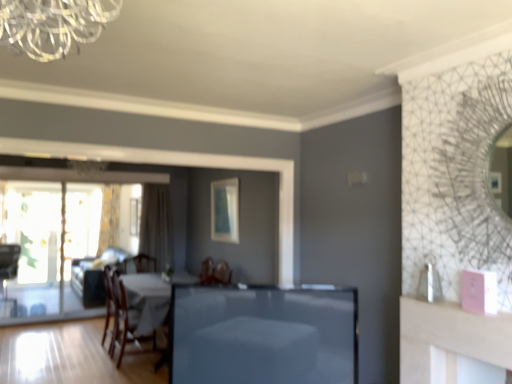
Where is `matte blue picture frame at center, the second picture frame positioned from the back`? This screenshot has height=384, width=512. matte blue picture frame at center, the second picture frame positioned from the back is located at coordinates (225, 210).

The image size is (512, 384). Find the location of `matte white picture frame at center, which is counted as the second picture frame, starting from the front`. matte white picture frame at center, which is counted as the second picture frame, starting from the front is located at coordinates (135, 216).

What do you see at coordinates (156, 225) in the screenshot?
I see `beige fabric curtain at left, which is the 2th curtain from back to front` at bounding box center [156, 225].

Find the location of a particular element. This screenshot has width=512, height=384. velvet beige couch at center is located at coordinates (95, 275).

Locate an element on the screen. Image resolution: width=512 pixels, height=384 pixels. matte blue picture frame at center, the second picture frame positioned from the back is located at coordinates (225, 210).

Which chair is the 2nd one when counting from the front of the matte white picture frame at center, which is counted as the second picture frame, starting from the front? Please provide its 2D coordinates.

[(120, 317)]

Between wooden chair at lower left, marked as the 2th chair in a left-to-right arrangement, and matte white picture frame at center, which is counted as the second picture frame, starting from the front, which one has larger size?

With larger size is wooden chair at lower left, marked as the 2th chair in a left-to-right arrangement.

Considering their positions, is wooden chair at lower left, marked as the 2th chair in a left-to-right arrangement, located in front of or behind matte white picture frame at center, which is counted as the second picture frame, starting from the front?

In the image, wooden chair at lower left, marked as the 2th chair in a left-to-right arrangement, appears in front of matte white picture frame at center, which is counted as the second picture frame, starting from the front.

From a real-world perspective, is wooden chair at lower left, positioned as the 2th chair in back-to-front order, beneath matte white picture frame at center, the second picture frame positioned from the right?

Yes, from a real-world perspective, wooden chair at lower left, positioned as the 2th chair in back-to-front order, is beneath matte white picture frame at center, the second picture frame positioned from the right.

Is wooden chair at lower left, positioned as the 1th chair in front-to-back order, at the left side of matte blue picture frame at center, the first picture frame in the front-to-back sequence?

Correct, you'll find wooden chair at lower left, positioned as the 1th chair in front-to-back order, to the left of matte blue picture frame at center, the first picture frame in the front-to-back sequence.

Consider the image. Is the depth of wooden chair at lower left, positioned as the 2th chair in back-to-front order, greater than that of matte blue picture frame at center, placed as the 2th picture frame when sorted from left to right?

No, it is in front of matte blue picture frame at center, placed as the 2th picture frame when sorted from left to right.

From their relative heights in the image, would you say wooden chair at lower left, positioned as the 2th chair in back-to-front order, is taller or shorter than matte blue picture frame at center, the first picture frame in the front-to-back sequence?

Considering their sizes, wooden chair at lower left, positioned as the 2th chair in back-to-front order, has more height than matte blue picture frame at center, the first picture frame in the front-to-back sequence.

Identify the location of the 1st picture frame positioned above the wooden chair at lower left, positioned as the 1th chair in front-to-back order (from a real-world perspective). Image resolution: width=512 pixels, height=384 pixels. (135, 216).

In the scene shown: Is matte white picture frame at center, the second picture frame positioned from the right, oriented away from wooden chair at lower left, positioned as the 1th chair in front-to-back order?

No, matte white picture frame at center, the second picture frame positioned from the right, is not facing the opposite direction of wooden chair at lower left, positioned as the 1th chair in front-to-back order.

Between matte white picture frame at center, which is counted as the second picture frame, starting from the front, and wooden chair at lower left, positioned as the 1th chair in front-to-back order, which one has more height?

With more height is wooden chair at lower left, positioned as the 1th chair in front-to-back order.

Is matte white picture frame at center, the second picture frame positioned from the right, placed right next to wooden chair at lower left, positioned as the 2th chair in back-to-front order?

No.

Is beige fabric curtain at left, placed as the first curtain when sorted from right to left, aimed at wooden chair at left, arranged as the second chair when viewed from the right?

No, beige fabric curtain at left, placed as the first curtain when sorted from right to left, does not turn towards wooden chair at left, arranged as the second chair when viewed from the right.

From a real-world perspective, is beige fabric curtain at left, which is counted as the 1th curtain, starting from the front, on wooden chair at left, arranged as the second chair when viewed from the right?

Yes.

Between beige fabric curtain at left, which is counted as the 1th curtain, starting from the front, and wooden chair at left, marked as the first chair in a left-to-right arrangement, which one is positioned in front?

beige fabric curtain at left, which is counted as the 1th curtain, starting from the front, is closer to the camera.

How many degrees apart are the facing directions of beige fabric curtain at left, which is counted as the 1th curtain, starting from the front, and wooden chair at left, the second chair in the front-to-back sequence?

They differ by 24.6 degrees in their facing directions.

Are clear glass screen door at left and textured beige curtain at left, placed as the first curtain when sorted from left to right, beside each other?

clear glass screen door at left is not next to textured beige curtain at left, placed as the first curtain when sorted from left to right, and they're not touching.

Is textured beige curtain at left, the 2th curtain when ordered from front to back, located within clear glass screen door at left?

No, textured beige curtain at left, the 2th curtain when ordered from front to back, is not inside clear glass screen door at left.

Based on the photo, between clear glass screen door at left and textured beige curtain at left, the 2th curtain when ordered from front to back, which one has more height?

clear glass screen door at left.

Considering the sizes of clear glass screen door at left and textured beige curtain at left, placed as the first curtain when sorted from left to right, in the image, is clear glass screen door at left bigger or smaller than textured beige curtain at left, placed as the first curtain when sorted from left to right,?

Clearly, clear glass screen door at left is larger in size than textured beige curtain at left, placed as the first curtain when sorted from left to right.

Considering the relative positions of matte blue picture frame at center, the first picture frame in the front-to-back sequence, and velvet beige couch at center in the image provided, is matte blue picture frame at center, the first picture frame in the front-to-back sequence, behind velvet beige couch at center?

No, matte blue picture frame at center, the first picture frame in the front-to-back sequence, is closer to the viewer.

In the scene shown: How much distance is there between matte blue picture frame at center, the 1th picture frame when ordered from right to left, and velvet beige couch at center?

A distance of 5.18 feet exists between matte blue picture frame at center, the 1th picture frame when ordered from right to left, and velvet beige couch at center.

From the image's perspective, is matte blue picture frame at center, the second picture frame positioned from the back, below velvet beige couch at center?

No.

Considering the sizes of objects matte blue picture frame at center, the 1th picture frame when ordered from right to left, and velvet beige couch at center in the image provided, who is shorter, matte blue picture frame at center, the 1th picture frame when ordered from right to left, or velvet beige couch at center?

matte blue picture frame at center, the 1th picture frame when ordered from right to left, is shorter.

The image size is (512, 384). I want to click on curtain on the left of velvet beige couch at center, so click(x=109, y=218).

Which of these two, velvet beige couch at center or textured beige curtain at left, the 2th curtain in the right-to-left sequence, stands taller?

With more height is textured beige curtain at left, the 2th curtain in the right-to-left sequence.

Measure the distance from velvet beige couch at center to textured beige curtain at left, the 2th curtain in the right-to-left sequence.

The distance of velvet beige couch at center from textured beige curtain at left, the 2th curtain in the right-to-left sequence, is 75.05 centimeters.

How different are the orientations of velvet beige couch at center and textured beige curtain at left, the 2th curtain in the right-to-left sequence, in degrees?

87.9 degrees.

Starting from the wooden chair at lower left, positioned as the 1th chair in front-to-back order, which picture frame is the 2nd one behind? Please provide its 2D coordinates.

[(135, 216)]

Image resolution: width=512 pixels, height=384 pixels. What are the coordinates of `chair in front of the matte blue picture frame at center, the 1th picture frame when ordered from right to left` in the screenshot? It's located at tap(120, 317).

From the picture: Looking at the image, which one is located further to wooden chair at left, the second chair in the front-to-back sequence, beige fabric curtain at left, arranged as the 2th curtain when viewed from the left, or matte blue picture frame at center, the first picture frame in the front-to-back sequence?

Based on the image, matte blue picture frame at center, the first picture frame in the front-to-back sequence, appears to be further to wooden chair at left, the second chair in the front-to-back sequence.

Which object lies further to the anchor point wooden chair at left, which appears as the 1th chair when viewed from the back, clear glass screen door at left or matte blue picture frame at center, the 1th picture frame when ordered from right to left?

matte blue picture frame at center, the 1th picture frame when ordered from right to left, is further to wooden chair at left, which appears as the 1th chair when viewed from the back.

When comparing their distances from wooden chair at left, arranged as the second chair when viewed from the right, does wooden chair at lower left, marked as the 2th chair in a left-to-right arrangement, or beige fabric curtain at left, placed as the first curtain when sorted from right to left, seem closer?

beige fabric curtain at left, placed as the first curtain when sorted from right to left, is positioned closer to the anchor wooden chair at left, arranged as the second chair when viewed from the right.

When comparing their distances from matte blue picture frame at center, the second picture frame positioned from the back, does wooden chair at left, the second chair in the front-to-back sequence, or textured beige curtain at left, the 2th curtain when ordered from front to back, seem closer?

textured beige curtain at left, the 2th curtain when ordered from front to back.

Estimate the real-world distances between objects in this image. Which object is further from wooden chair at left, marked as the first chair in a left-to-right arrangement, clear glass screen door at left or smooth glass table at center?

smooth glass table at center.

From the image, which object appears to be farther from clear glass screen door at left, beige fabric curtain at left, which is counted as the 1th curtain, starting from the front, or wooden chair at lower left, positioned as the 1th chair in front-to-back order?

wooden chair at lower left, positioned as the 1th chair in front-to-back order, lies further to clear glass screen door at left than the other object.

When comparing their distances from wooden chair at left, marked as the first chair in a left-to-right arrangement, does textured beige curtain at left, the 2th curtain when ordered from front to back, or beige fabric curtain at left, which is the 2th curtain from back to front, seem closer?

Based on the image, textured beige curtain at left, the 2th curtain when ordered from front to back, appears to be nearer to wooden chair at left, marked as the first chair in a left-to-right arrangement.

Looking at the image, which one is located further to beige fabric curtain at left, which is the 2th curtain from back to front, smooth glass table at center or wooden chair at lower left, positioned as the 1th chair in front-to-back order?

smooth glass table at center.

Where is `chair positioned between wooden chair at lower left, the first chair positioned from the right, and textured beige curtain at left, placed as the 1th curtain when sorted from back to front, from near to far`? chair positioned between wooden chair at lower left, the first chair positioned from the right, and textured beige curtain at left, placed as the 1th curtain when sorted from back to front, from near to far is located at coordinates (8, 263).

Locate an element on the screen. This screenshot has width=512, height=384. picture frame between wooden chair at left, the second chair in the front-to-back sequence, and beige fabric curtain at left, arranged as the 2th curtain when viewed from the left, in the horizontal direction is located at coordinates (135, 216).

Find the location of a particular element. This screenshot has height=384, width=512. screen door between wooden chair at left, arranged as the second chair when viewed from the right, and wooden chair at lower left, marked as the 2th chair in a left-to-right arrangement is located at coordinates (49, 244).

Find the location of a particular element. This screenshot has width=512, height=384. curtain positioned between matte blue picture frame at center, placed as the 2th picture frame when sorted from left to right, and textured beige curtain at left, placed as the 1th curtain when sorted from back to front, from near to far is located at coordinates (156, 225).